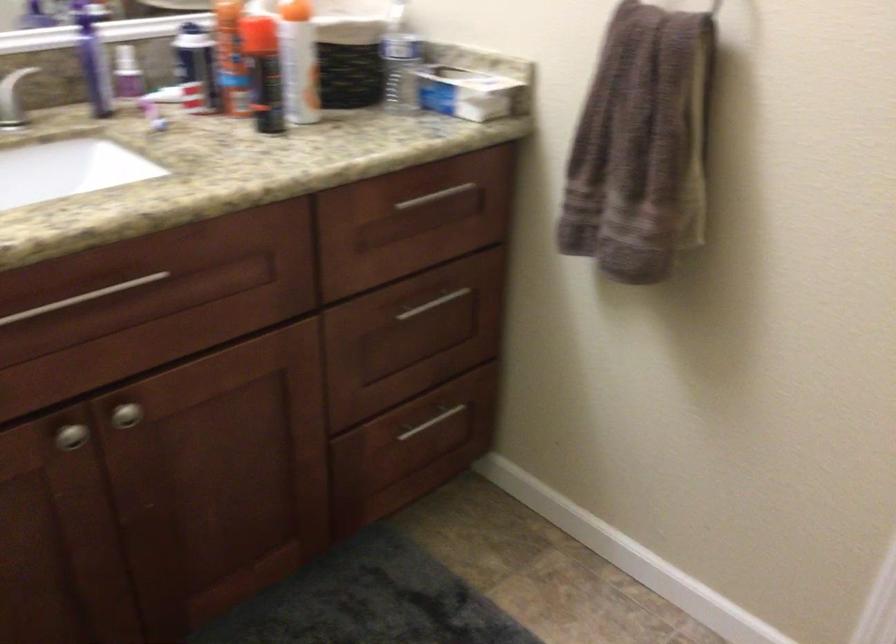
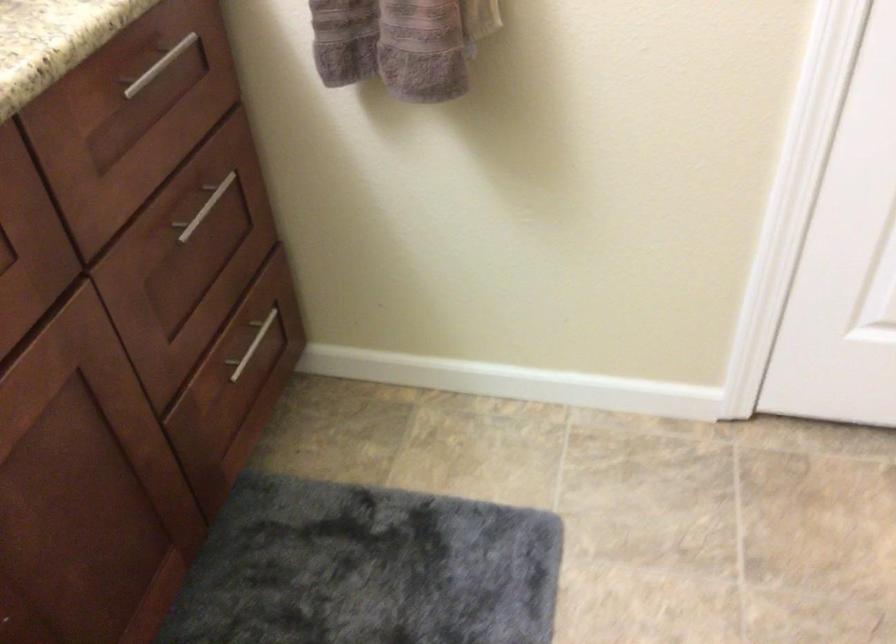
Based on the photo, the first image is from the beginning of the video and the second image is from the end. How did the camera likely rotate when shooting the video?

The camera rotated toward right-down.